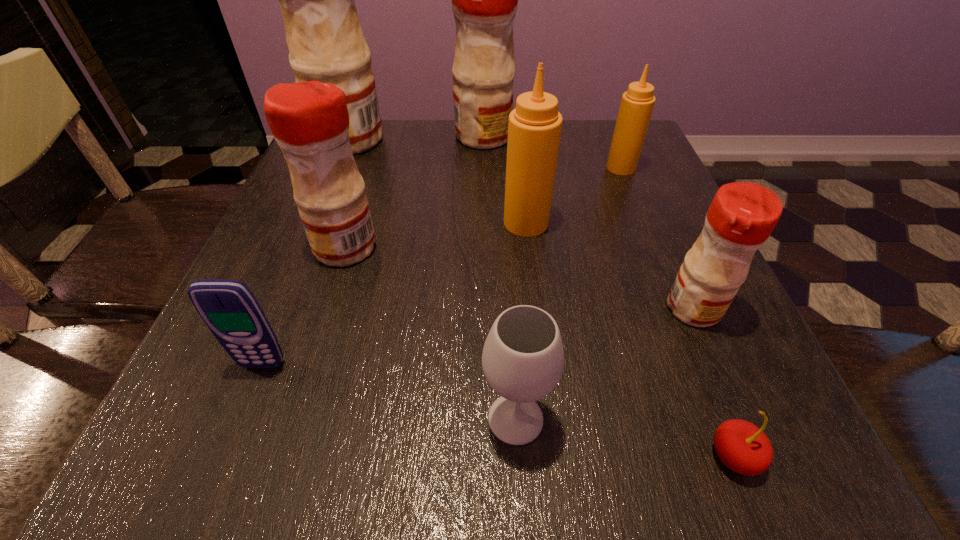
Locate an element on the screen. The width and height of the screenshot is (960, 540). vacant space located on the back of the fourth nearest object is located at coordinates (643, 194).

Locate an element on the screen. The height and width of the screenshot is (540, 960). vacant space located 0.180m on the back of the wineglass is located at coordinates (508, 291).

Where is `vacant point located 0.080m on the front-facing side of the third nearest object`? vacant point located 0.080m on the front-facing side of the third nearest object is located at coordinates (240, 422).

Locate an element on the screen. vacant area situated on the left of the shortest object is located at coordinates (603, 456).

Find the location of a particular element. The height and width of the screenshot is (540, 960). wineglass that is at the near edge is located at coordinates (523, 357).

This screenshot has width=960, height=540. I want to click on cherry that is positioned at the near edge, so click(x=744, y=448).

Where is `cellular telephone that is at the left edge`? cellular telephone that is at the left edge is located at coordinates (228, 307).

At what (x,y) coordinates should I click in order to perform the action: click on cherry that is at the right edge. Please return your answer as a coordinate pair (x, y). The height and width of the screenshot is (540, 960). Looking at the image, I should click on (744, 448).

Where is `object situated at the far left corner`? This screenshot has width=960, height=540. object situated at the far left corner is located at coordinates (324, 36).

Find the location of a particular element. The height and width of the screenshot is (540, 960). object present at the far right corner is located at coordinates (637, 103).